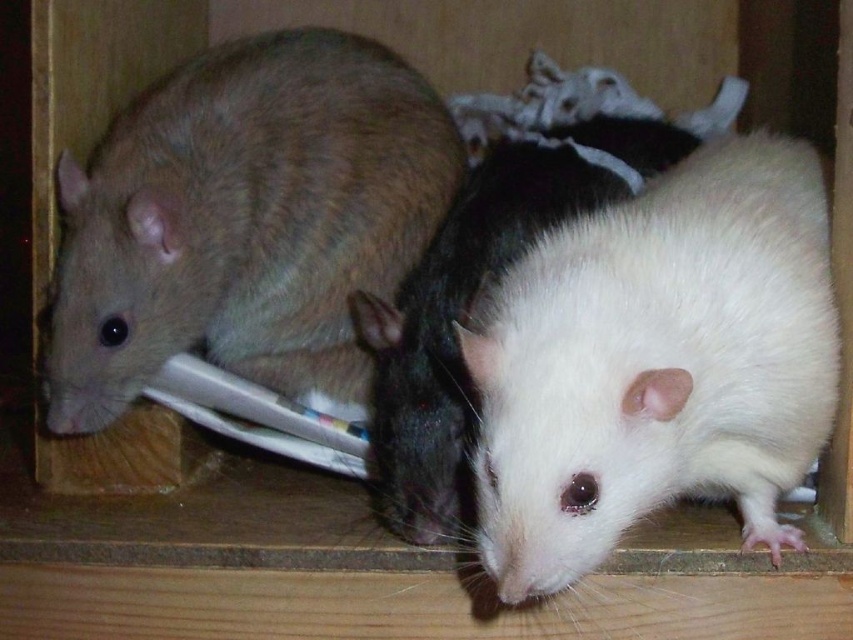
Question: Is matte brown mouse at left wider than white matte fur mouse at center?

Choices:
 (A) yes
 (B) no

Answer: (B)

Question: Does matte brown mouse at left appear over white matte fur mouse at center?

Choices:
 (A) no
 (B) yes

Answer: (B)

Question: Which of the following is the farthest from the observer?

Choices:
 (A) matte brown mouse at left
 (B) white matte fur mouse at center

Answer: (A)

Question: Does matte brown mouse at left come in front of white matte fur mouse at center?

Choices:
 (A) yes
 (B) no

Answer: (B)